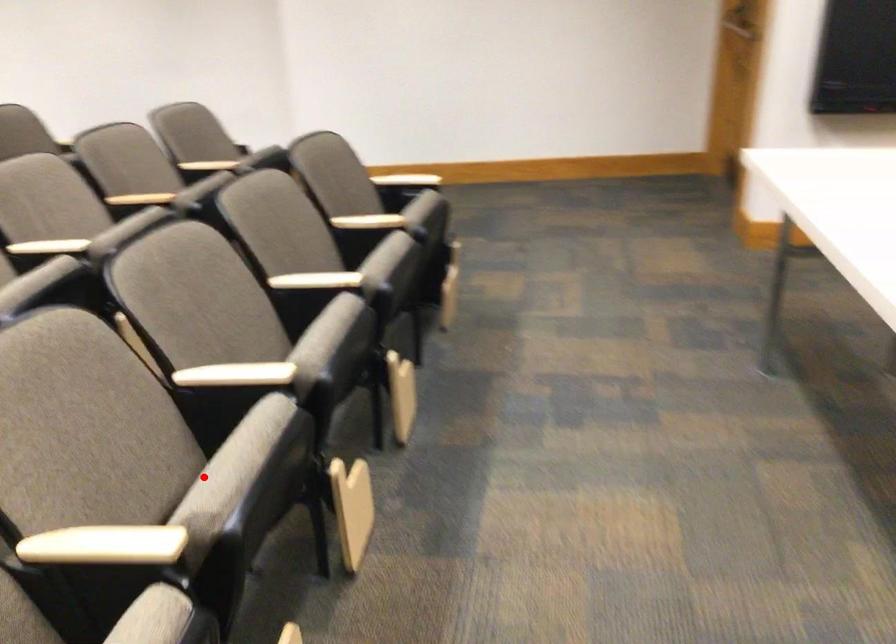
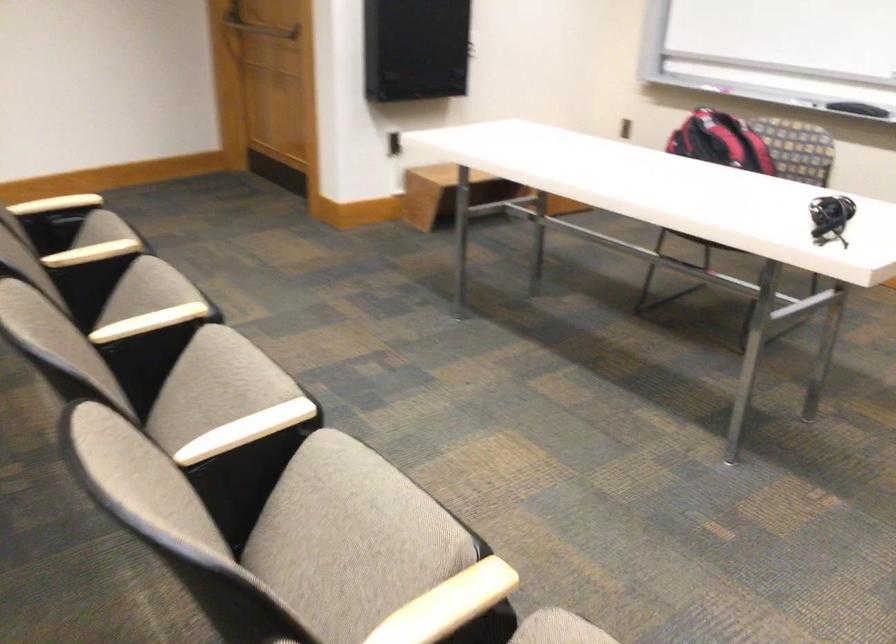
Where in the second image is the point corresponding to the highlighted location from the first image?

(352, 531)